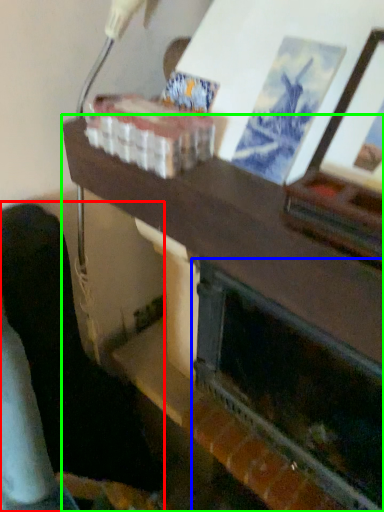
Question: Which object is the closest to the furniture (highlighted by a red box)? Choose among these: fireplace (highlighted by a blue box) or table (highlighted by a green box).

Choices:
 (A) fireplace
 (B) table

Answer: (B)